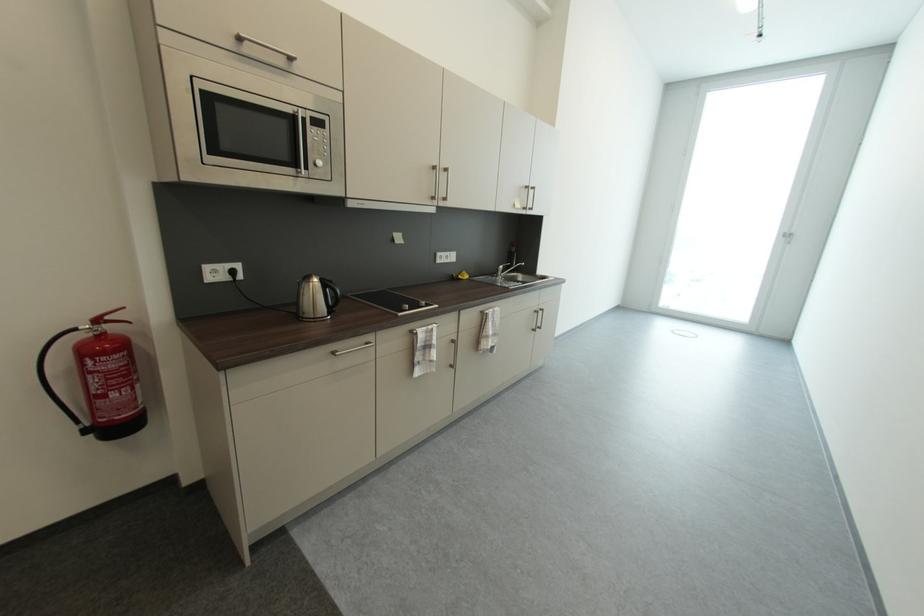
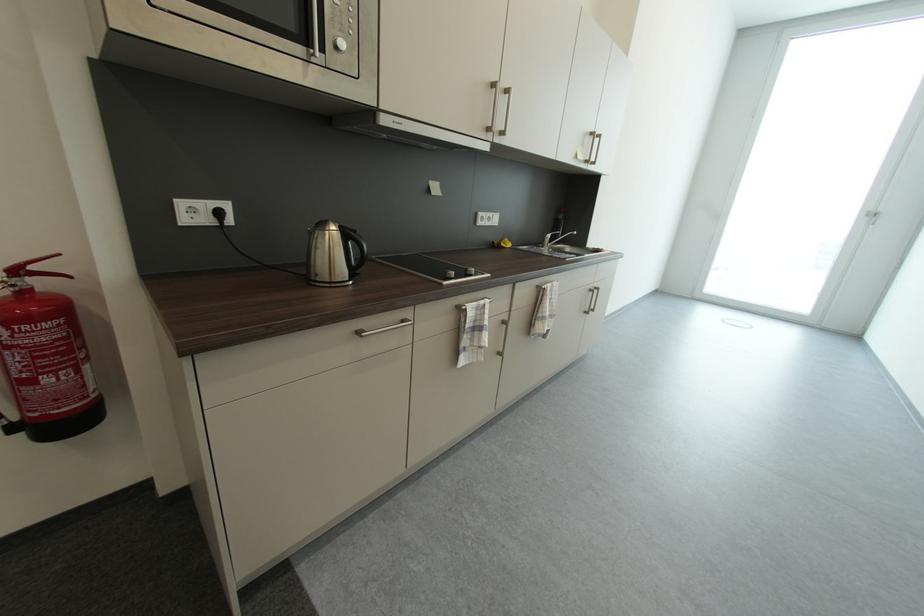
Locate, in the second image, the point that corresponds to point 96,330 in the first image.

(8, 284)